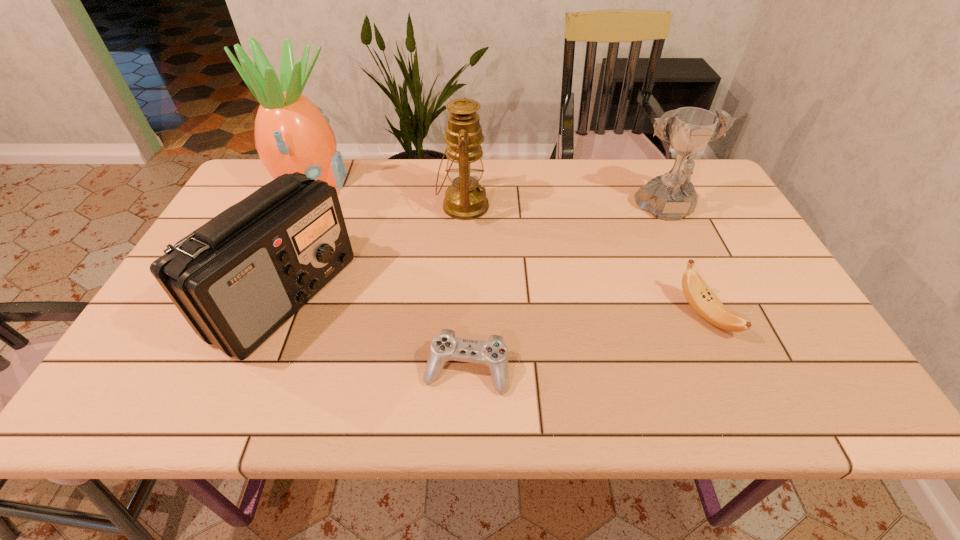
You are a GUI agent. You are given a task and a screenshot of the screen. Output one action in this format:
    pyautogui.click(x=<x>, y=<y>)
    Task: Click on the object situated at the far right corner
    
    Given the screenshot: What is the action you would take?
    pyautogui.click(x=670, y=197)

This screenshot has width=960, height=540. Identify the location of free space at the far edge of the desktop. (351, 168).

In the image, there is a desktop. What are the coordinates of `free space at the near edge` in the screenshot? It's located at (280, 381).

In the image, there is a desktop. Where is `free space at the left edge`? free space at the left edge is located at coordinates pyautogui.click(x=201, y=373).

Image resolution: width=960 pixels, height=540 pixels. In the image, there is a desktop. Identify the location of vacant area at the right edge. (710, 262).

Locate an element on the screen. This screenshot has width=960, height=540. free area in between the banana and the shortest object is located at coordinates (586, 342).

Locate an element on the screen. The height and width of the screenshot is (540, 960). vacant space that's between the pineapple and the control is located at coordinates (389, 275).

Image resolution: width=960 pixels, height=540 pixels. I want to click on free space between the banana and the award, so click(686, 264).

The image size is (960, 540). I want to click on free area in between the radio receiver and the oil lamp, so click(373, 251).

Image resolution: width=960 pixels, height=540 pixels. What are the coordinates of `empty space that is in between the award and the radio receiver` in the screenshot? It's located at (475, 254).